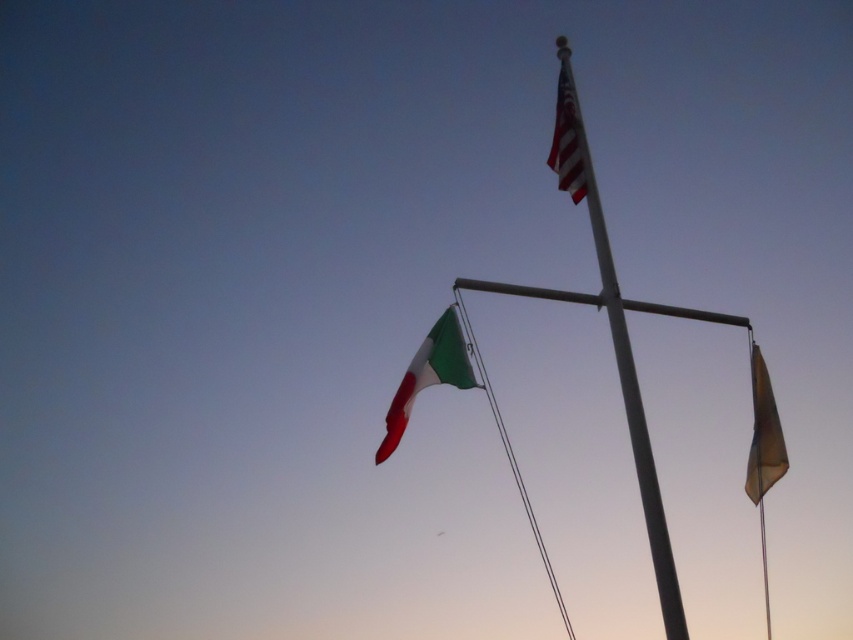
You are standing at the center of the image. Which direction should you move to reach the white metallic mast at center?

The white metallic mast at center is already at the center of the image, so you don not need to move in any direction to reach it.

You are an observer standing in front of the white metallic flag pole at center and the brown fabric flag at right. Which object is closer to you?

The white metallic flag pole at center is closer to you than the brown fabric flag at right because it is positioned over it.